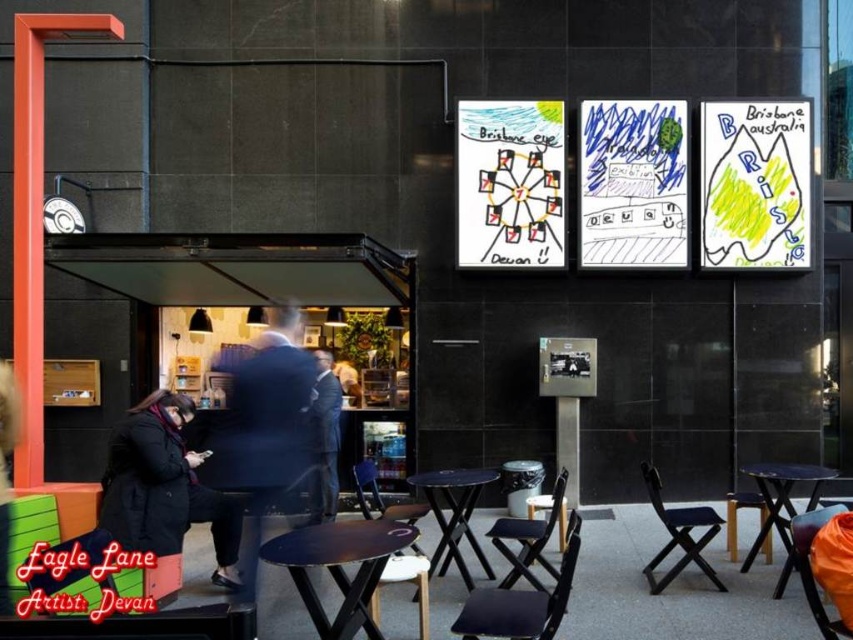
Question: Which point is farther to the camera?

Choices:
 (A) (216, 522)
 (B) (442, 477)
 (C) (421, 554)
 (D) (334, 481)

Answer: (D)

Question: Can you confirm if black suit at center is smaller than dark gray suit at center?

Choices:
 (A) no
 (B) yes

Answer: (A)

Question: Is matte black table at center positioned behind black plastic table at center?

Choices:
 (A) no
 (B) yes

Answer: (A)

Question: Can you confirm if black wool coat at lower left is smaller than matte black chair at center?

Choices:
 (A) no
 (B) yes

Answer: (B)

Question: Estimate the real-world distances between objects in this image. Which object is closer to the black fabric chair at lower right?

Choices:
 (A) black plastic table at center
 (B) black wool coat at lower left
 (C) matte black chair at center
 (D) matte black table at center

Answer: (A)

Question: Which of the following is the closest to the observer?

Choices:
 (A) matte black table at center
 (B) black suit at center
 (C) black wood chair at center
 (D) black plastic table at lower right

Answer: (A)